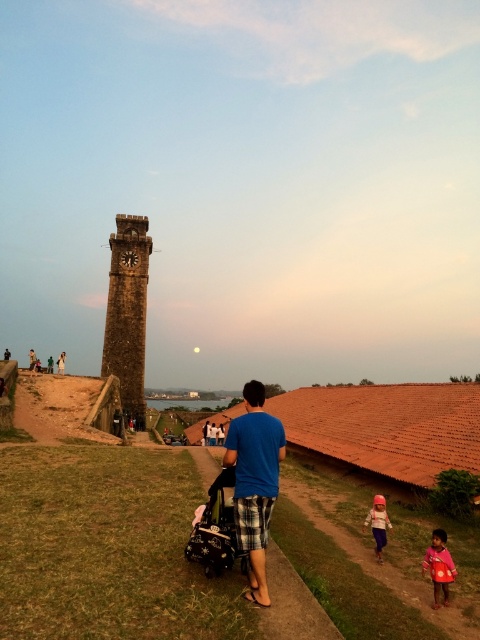
Is the position of black fabric baby carriage at center more distant than that of pink fabric child at lower right?

No.

Based on the photo, who is more distant from viewer, (196,534) or (443,573)?

The point (196,534) is behind.

Identify the location of black fabric baby carriage at center. (216, 531).

Is point (372, 525) closer to viewer compared to point (31, 358)?

Yes, it is in front of point (31, 358).

Who is positioned more to the left, pink fabric dress at lower right or blue plaid shorts at center?

blue plaid shorts at center

Is point (381, 509) positioned in front of point (28, 349)?

Yes.

Where is `pink fabric dress at lower right`? The height and width of the screenshot is (640, 480). pink fabric dress at lower right is located at coordinates coord(377,524).

Can you confirm if blue cotton shirt at center is thinner than black fabric baby carriage at center?

Yes.

Is blue cotton shirt at center wider than black fabric baby carriage at center?

No.

I want to click on blue cotton shirt at center, so click(254, 481).